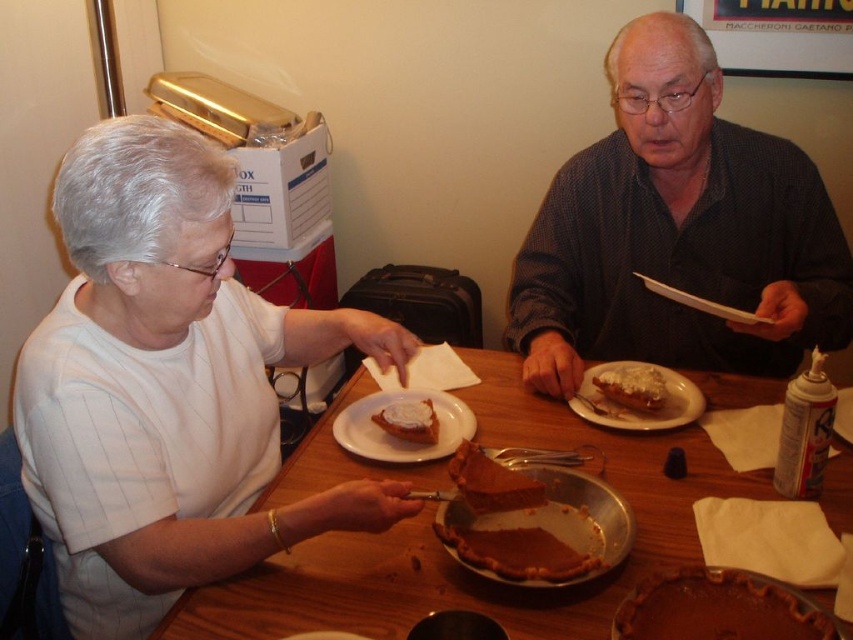
Question: Which of the following is the closest to the observer?

Choices:
 (A) dark blue textured shirt at upper right
 (B) white matte shirt at left
 (C) chocolate matte cake at center
 (D) metallic silver pie dish at center

Answer: (C)

Question: Does white matte shirt at left have a larger size compared to metallic silver pie dish at center?

Choices:
 (A) yes
 (B) no

Answer: (A)

Question: Is dark blue textured shirt at upper right further to camera compared to chocolate cake at center?

Choices:
 (A) yes
 (B) no

Answer: (A)

Question: Is metallic silver pie dish at center bigger than white frosted cake at center?

Choices:
 (A) yes
 (B) no

Answer: (A)

Question: Which object is the farthest from the metallic silver pie dish at center?

Choices:
 (A) slightly browned crusty bread at upper right
 (B) white glazed pastry at center
 (C) wooden table at center
 (D) chocolate cake at center

Answer: (A)

Question: Which object is closer to the camera taking this photo?

Choices:
 (A) slightly browned crusty bread at upper right
 (B) metallic silver pie dish at center
 (C) wooden table at center

Answer: (C)